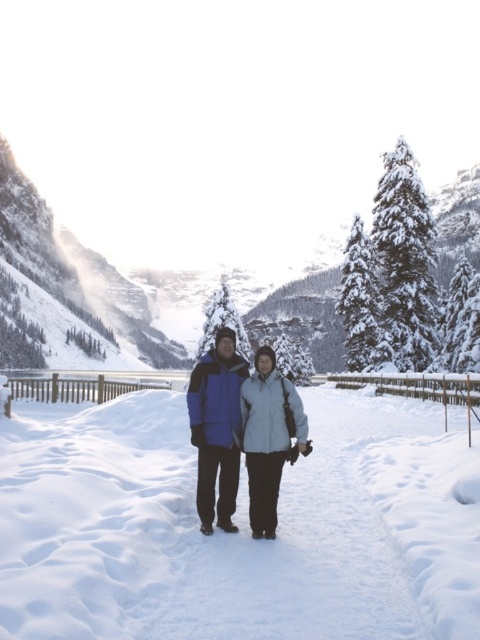
Does blue synthetic jacket at center have a smaller size compared to light blue fabric jacket at center?

Incorrect, blue synthetic jacket at center is not smaller in size than light blue fabric jacket at center.

Does point (207, 522) lie behind point (269, 358)?

No, it is in front of (269, 358).

The height and width of the screenshot is (640, 480). Identify the location of blue synthetic jacket at center. (217, 428).

Where is `blue synthetic jacket at center`? This screenshot has height=640, width=480. blue synthetic jacket at center is located at coordinates (217, 428).

Which is in front, point (335, 358) or point (215, 417)?

Point (215, 417) is in front.

Which of these two, snowy granite mountain at center or blue synthetic jacket at center, stands shorter?

Standing shorter between the two is blue synthetic jacket at center.

Describe the element at coordinates (96, 275) in the screenshot. I see `snowy granite mountain at center` at that location.

The height and width of the screenshot is (640, 480). In order to click on snowy granite mountain at center in this screenshot , I will do `click(96, 275)`.

Which is behind, point (21, 612) or point (205, 371)?

Positioned behind is point (205, 371).

What do you see at coordinates (239, 525) in the screenshot? I see `white fluffy snow at center` at bounding box center [239, 525].

You are a GUI agent. You are given a task and a screenshot of the screen. Output one action in this format:
    pyautogui.click(x=<x>, y=<y>)
    Task: Click on the white fluffy snow at center
    Image resolution: width=480 pixels, height=640 pixels.
    Given the screenshot: What is the action you would take?
    pyautogui.click(x=239, y=525)